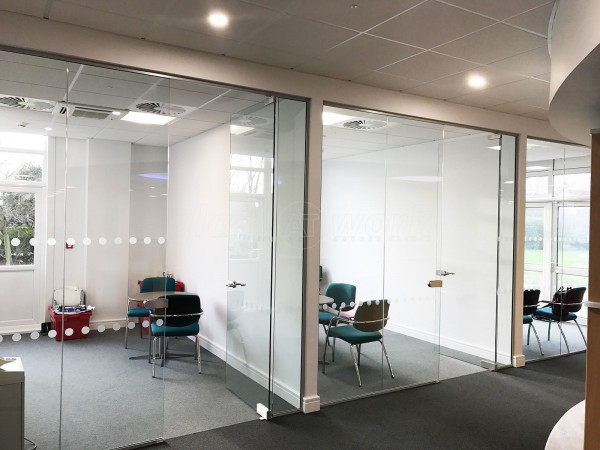
You are a GUI agent. You are given a task and a screenshot of the screen. Output one action in this format:
    pyautogui.click(x=<x>, y=<y>)
    Task: Click on the wall
    The height and width of the screenshot is (450, 600).
    Given the screenshot: What is the action you would take?
    coord(196,190), coord(356,189), coord(98,168)